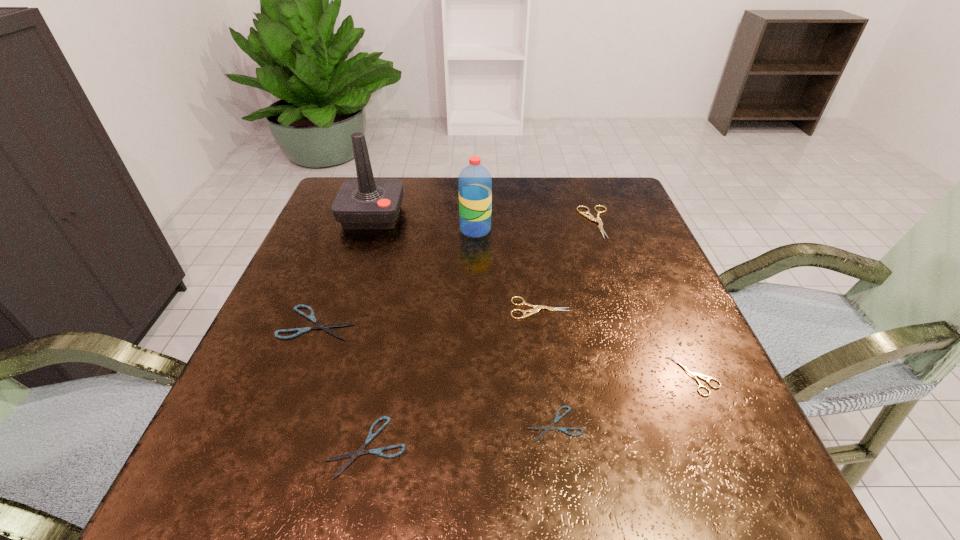
This screenshot has width=960, height=540. I want to click on free space that is in between the rightmost black shears and the nearest beige shears, so pos(625,400).

Locate an element on the screen. This screenshot has height=540, width=960. vacant area between the leftmost beige shears and the second tallest object is located at coordinates (508, 269).

At what (x,y) coordinates should I click in order to perform the action: click on vacant space that's between the fourth tallest object and the second black shears from left to right. Please return your answer as a coordinate pair (x, y). This screenshot has width=960, height=540. Looking at the image, I should click on (453, 377).

This screenshot has width=960, height=540. Identify the location of vacant area that lies between the rightmost black shears and the second smallest beige shears. (547, 366).

The image size is (960, 540). I want to click on free area in between the second black shears from right to left and the leftmost black shears, so click(343, 384).

Locate an element on the screen. Image resolution: width=960 pixels, height=540 pixels. vacant point located between the fifth shears from right to left and the biggest black shears is located at coordinates (343, 384).

Where is `vacant space in between the rightmost black shears and the leftmost beige shears`? vacant space in between the rightmost black shears and the leftmost beige shears is located at coordinates (547, 366).

Identify which object is located as the sixth nearest to the second beige shears from left to right. Please provide its 2D coordinates. Your answer should be formatted as a tuple, i.e. [(x, y)], where the tuple contains the x and y coordinates of a point satisfying the conditions above.

[(311, 317)]

Find the location of a particular element. object that is the third closest to the biggest black shears is located at coordinates (475, 182).

Locate an element on the screen. This screenshot has height=540, width=960. the closest shears to the tallest shears is located at coordinates (536, 309).